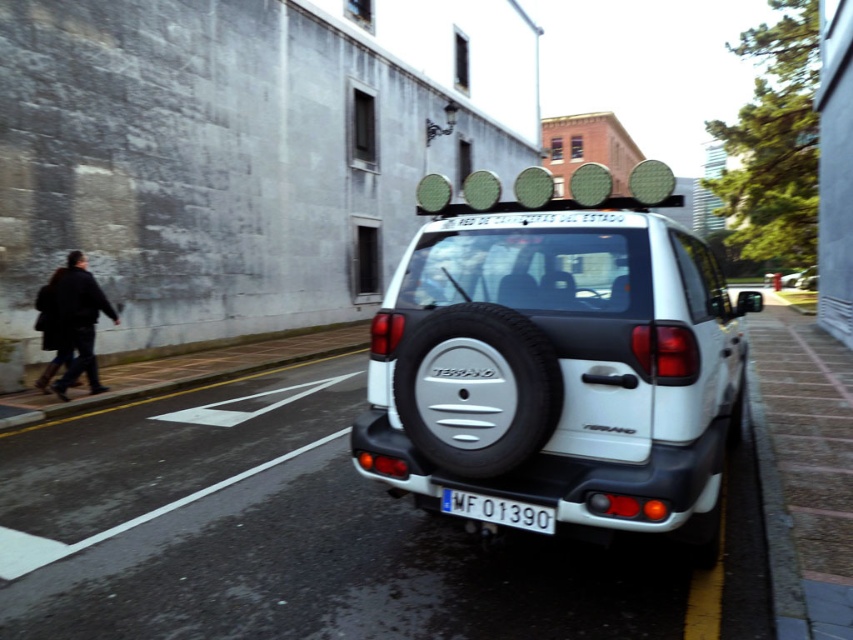
Question: Does white matte minivan at center have a greater width compared to white plastic license plate at center?

Choices:
 (A) yes
 (B) no

Answer: (A)

Question: Is white matte minivan at center further to camera compared to white plastic license plate at center?

Choices:
 (A) yes
 (B) no

Answer: (B)

Question: Which of the following is the closest to the observer?

Choices:
 (A) dark wool coat at left
 (B) white plastic license plate at center

Answer: (B)

Question: Among these objects, which one is nearest to the camera?

Choices:
 (A) dark wool coat at left
 (B) white plastic license plate at center

Answer: (B)

Question: Which of these objects is positioned closest to the dark wool coat at left?

Choices:
 (A) white matte minivan at center
 (B) white plastic license plate at center

Answer: (A)

Question: From the image, what is the correct spatial relationship of white matte minivan at center in relation to dark wool coat at left?

Choices:
 (A) below
 (B) above

Answer: (B)